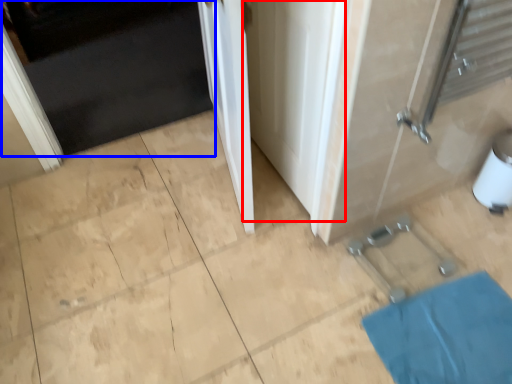
Question: Which point is closer to the camera, screen door (highlighted by a red box) or door (highlighted by a blue box)?

Choices:
 (A) screen door
 (B) door

Answer: (A)